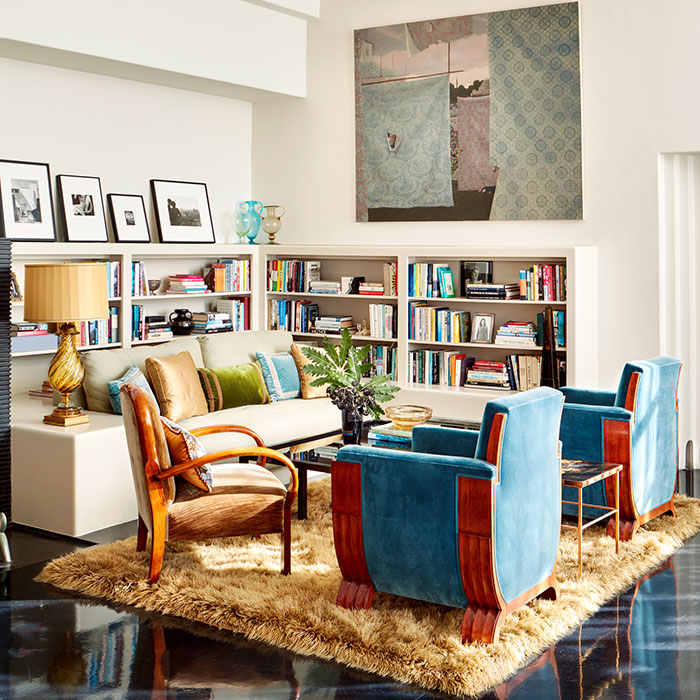
The width and height of the screenshot is (700, 700). In order to click on photographs in this screenshot , I will do `click(29, 217)`, `click(80, 211)`, `click(129, 218)`, `click(176, 208)`.